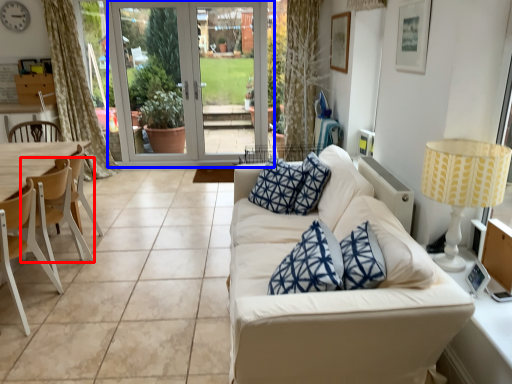
Question: Which point is further to the camera, chair (highlighted by a red box) or screen door (highlighted by a blue box)?

Choices:
 (A) chair
 (B) screen door

Answer: (B)